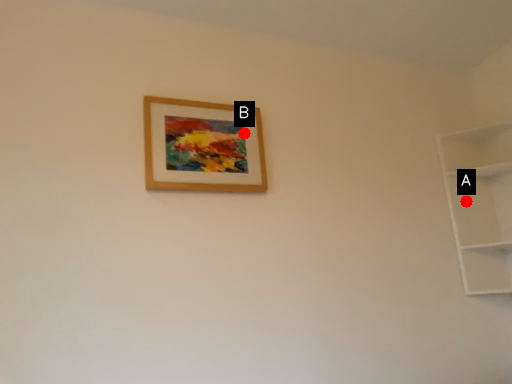
Question: Two points are circled on the image, labeled by A and B beside each circle. Which point is further to the camera?

Choices:
 (A) A is further
 (B) B is further

Answer: (A)